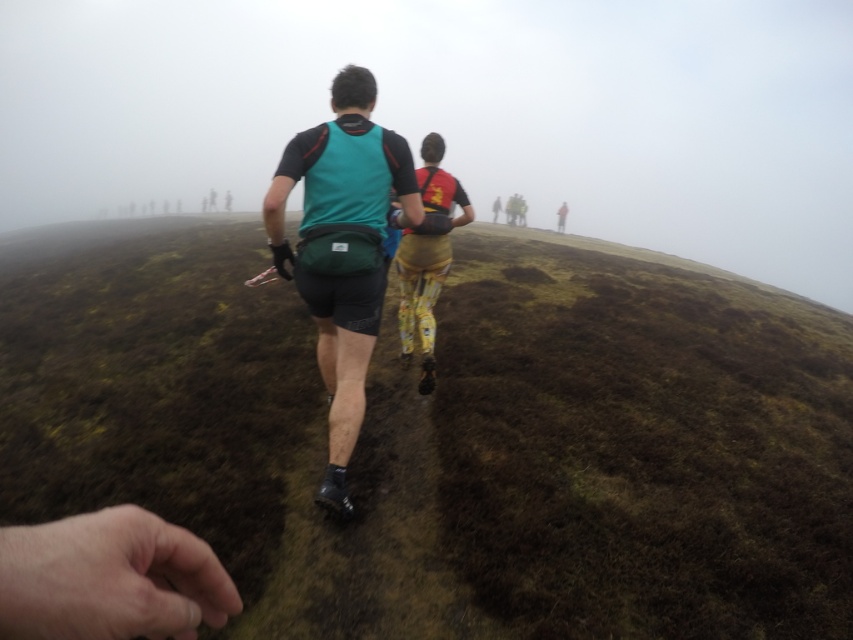
How far apart are dark brown mossy ground at center and teal fabric backpack at center?

dark brown mossy ground at center and teal fabric backpack at center are 4.76 meters apart from each other.

Does point (724, 589) come behind point (355, 412)?

No, (724, 589) is closer to viewer.

The height and width of the screenshot is (640, 853). Identify the location of dark brown mossy ground at center. (x=445, y=435).

Does teal fabric backpack at center have a smaller size compared to yellow patterned pants at center?

Correct, teal fabric backpack at center occupies less space than yellow patterned pants at center.

Measure the distance between point (306, 179) and camera.

A distance of 2.97 meters exists between point (306, 179) and camera.

Identify the location of teal fabric backpack at center. point(349,225).

In order to click on teal fabric backpack at center in this screenshot , I will do `click(349, 225)`.

In the scene shown: Is dark brown mossy ground at center to the left of yellow patterned pants at center from the viewer's perspective?

Yes, dark brown mossy ground at center is to the left of yellow patterned pants at center.

Is point (677, 528) positioned behind point (428, 236)?

No, (677, 528) is closer to viewer.

The height and width of the screenshot is (640, 853). What do you see at coordinates (445, 435) in the screenshot?
I see `dark brown mossy ground at center` at bounding box center [445, 435].

Where is `dark brown mossy ground at center`? The image size is (853, 640). dark brown mossy ground at center is located at coordinates (445, 435).